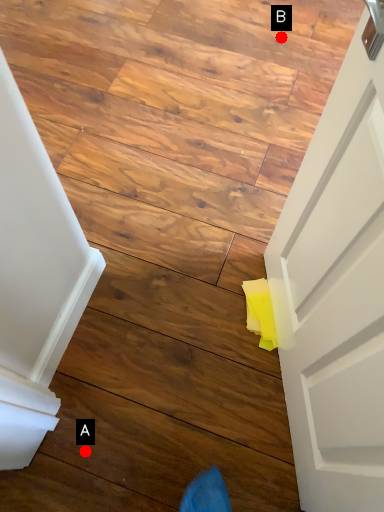
Question: Two points are circled on the image, labeled by A and B beside each circle. Which point appears farthest from the camera in this image?

Choices:
 (A) A is further
 (B) B is further

Answer: (B)